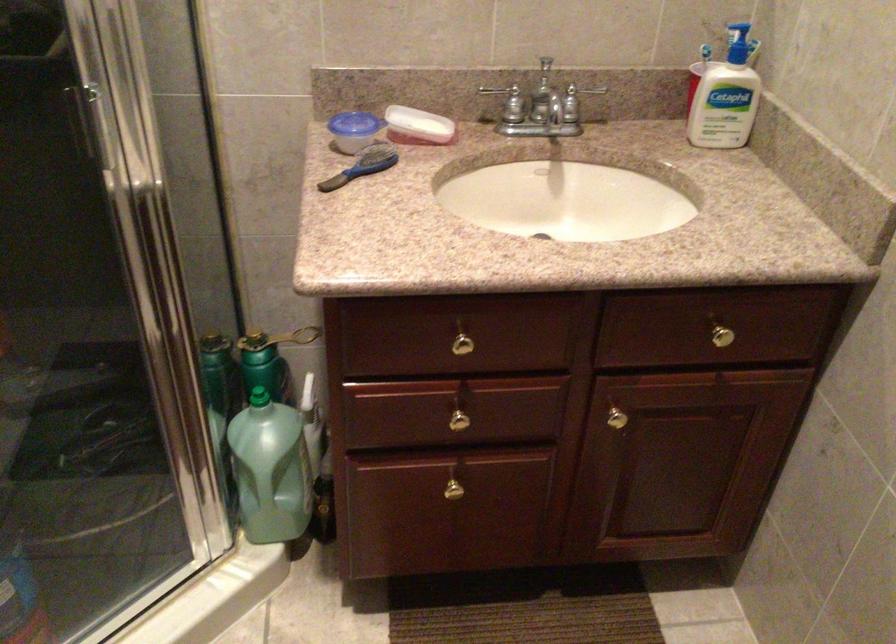
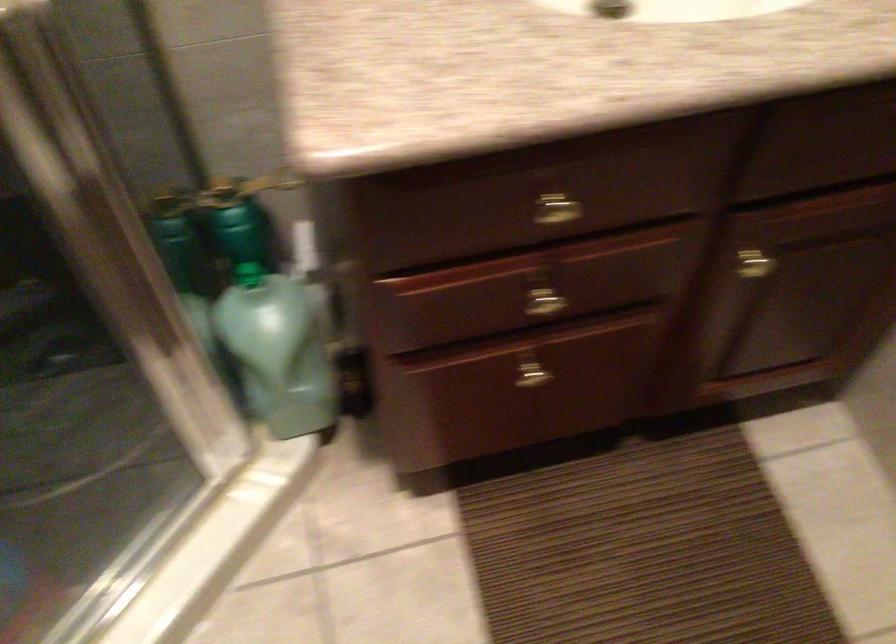
Question: The images are taken continuously from a first-person perspective. In which direction are you moving?

Choices:
 (A) Left
 (B) Right
 (C) Forward
 (D) Backward

Answer: (C)